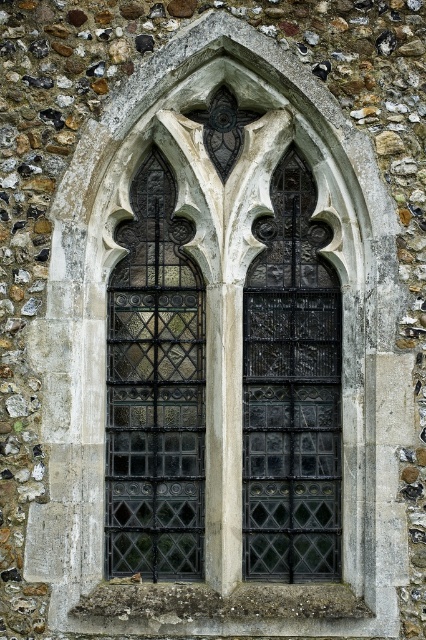
Which is below, dark stained glass at left or black textured glass at center?

black textured glass at center is lower down.

Who is higher up, dark stained glass at left or black textured glass at center?

Positioned higher is dark stained glass at left.

Is point (109, 504) more distant than point (285, 522)?

Yes, it is.

Identify the location of dark stained glass at left. (155, 388).